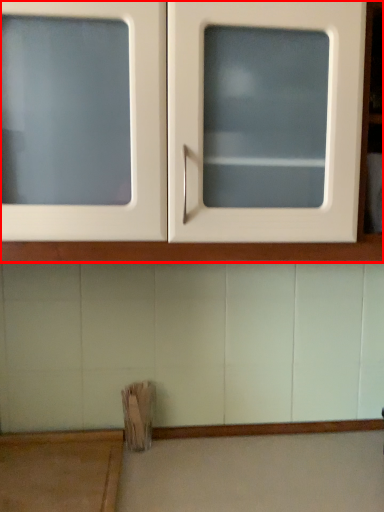
Question: In this image, where is cabinetry (annotated by the red box) located relative to table?

Choices:
 (A) right
 (B) left

Answer: (A)